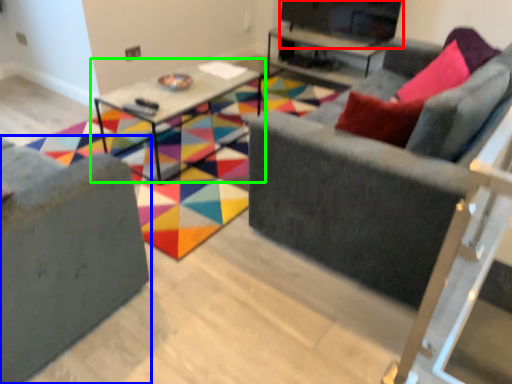
Question: Based on their relative distances, which object is nearer to entertainment center (highlighted by a red box)? Choose from studio couch (highlighted by a blue box) and table (highlighted by a green box).

Choices:
 (A) studio couch
 (B) table

Answer: (B)